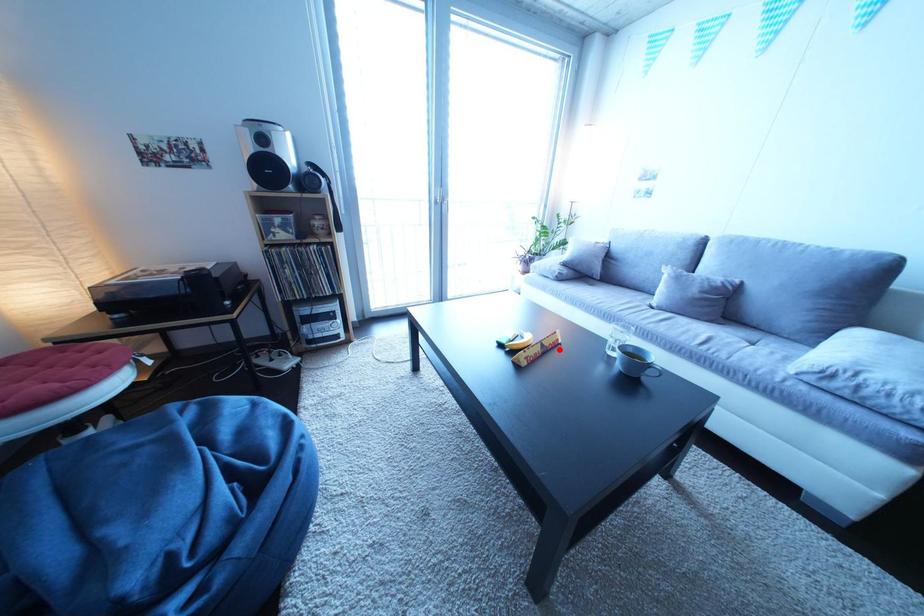
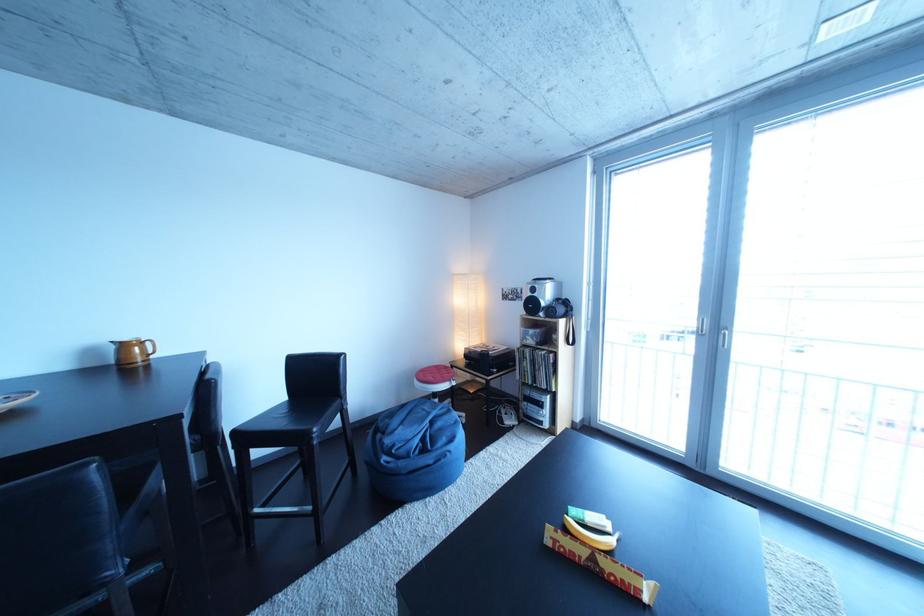
In the second image, find the point that corresponds to the highlighted location in the first image.

(617, 570)